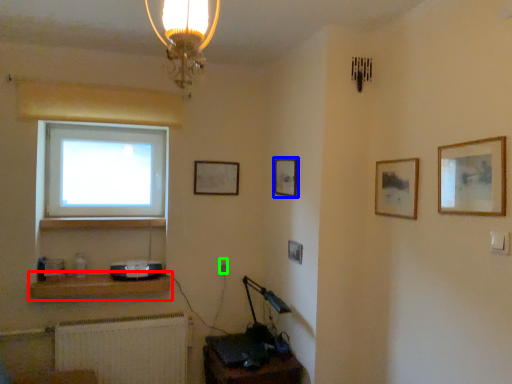
Question: Which object is positioned closest to shelf (highlighted by a red box)? Select from picture frame (highlighted by a blue box) and electric outlet (highlighted by a green box).

Choices:
 (A) picture frame
 (B) electric outlet

Answer: (B)